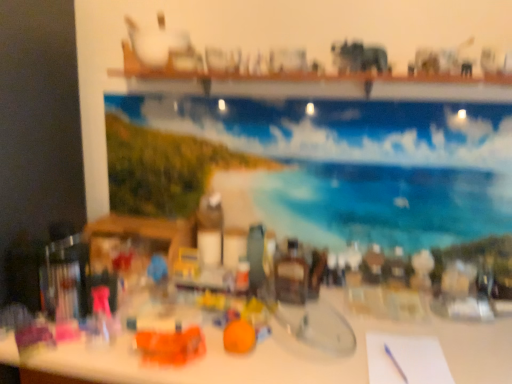
Identify the location of vacant point to the left of white paper at lower right. This screenshot has height=384, width=512. (327, 356).